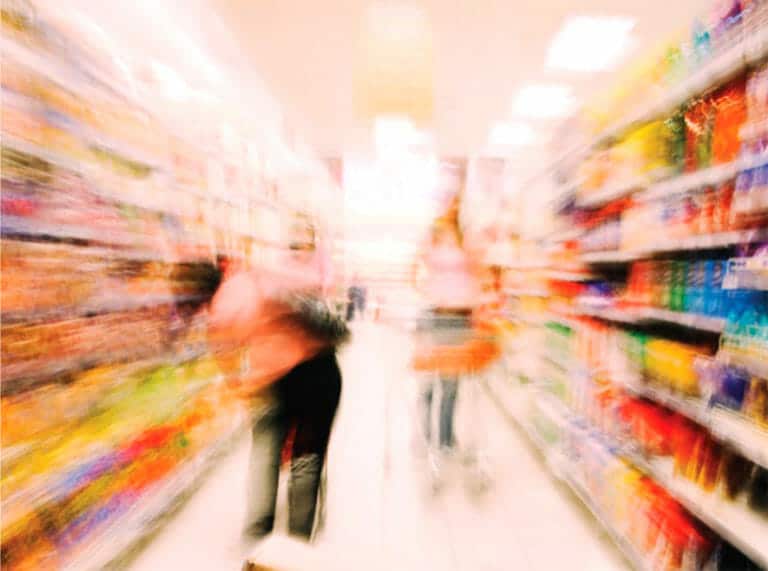
The width and height of the screenshot is (768, 571). Find the location of `light`. light is located at coordinates (587, 69), (545, 100), (510, 146), (402, 139).